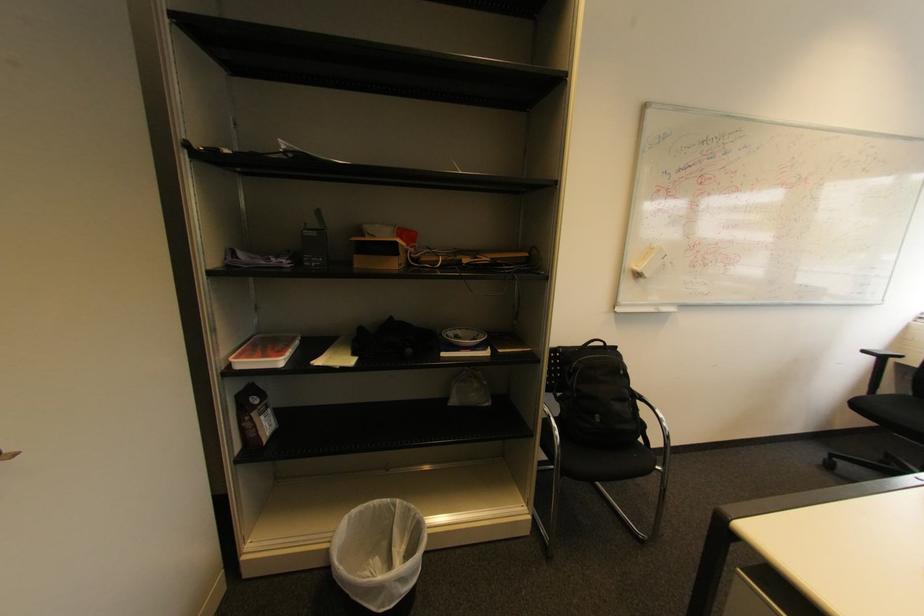
Find where to placing arm the black chair armrest. Please return your answer as a coordinate pair (x, y).

(882, 355)